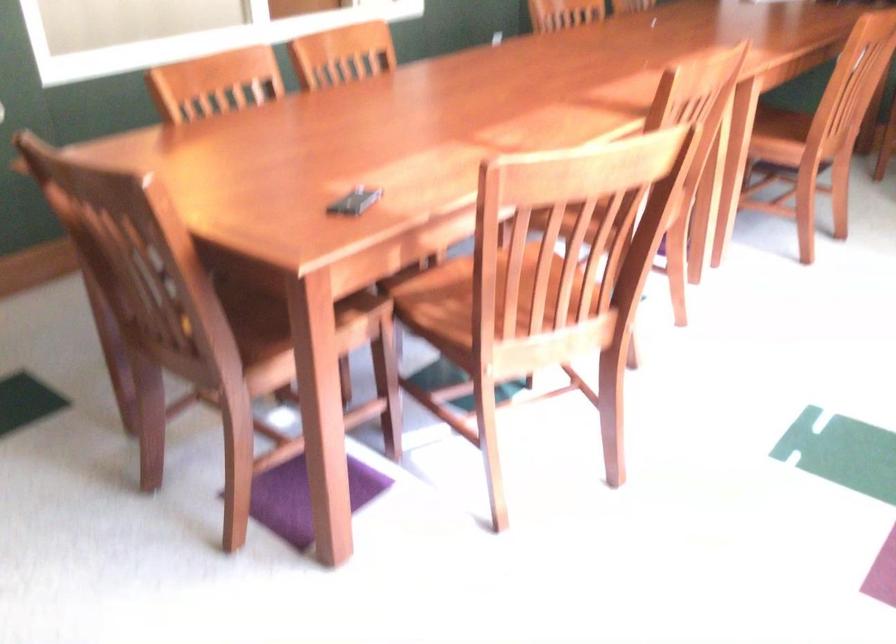
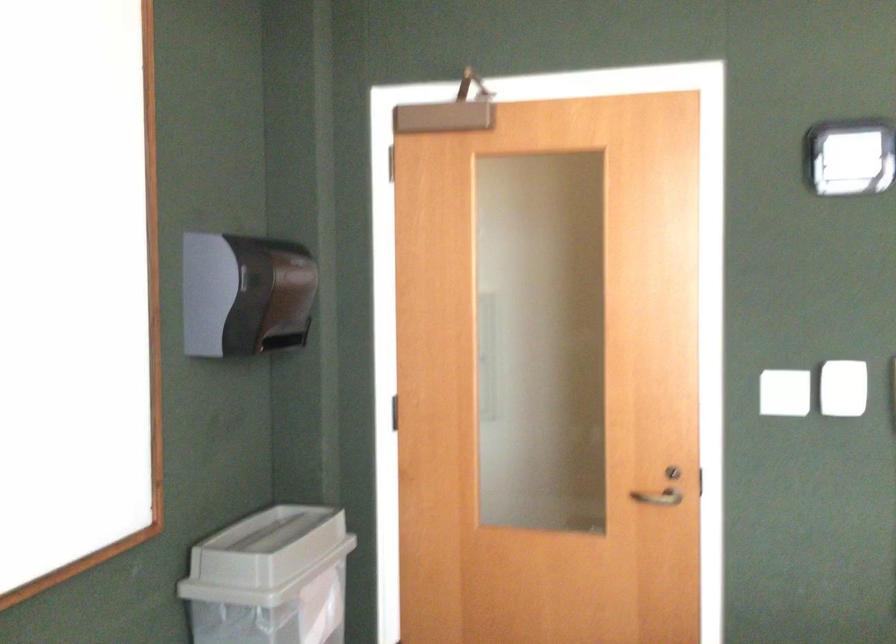
Question: The first image is from the beginning of the video and the second image is from the end. How did the camera likely rotate when shooting the video?

Choices:
 (A) Left
 (B) Right
 (C) Up
 (D) Down

Answer: (A)